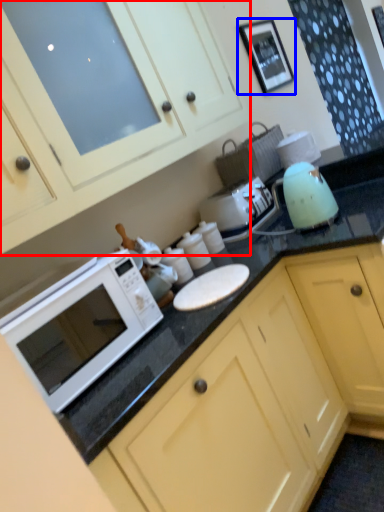
Question: Which object appears farthest to the camera in this image, cabinetry (highlighted by a red box) or picture frame (highlighted by a blue box)?

Choices:
 (A) cabinetry
 (B) picture frame

Answer: (B)